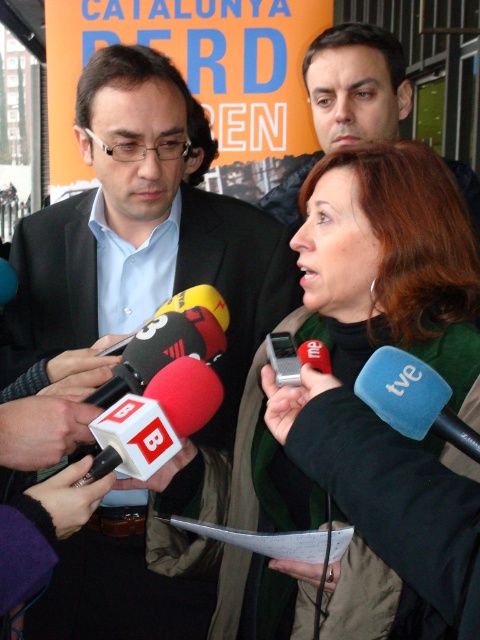
Question: Can you confirm if matte black jacket at upper center is positioned above blue rubber microphone at center?

Choices:
 (A) yes
 (B) no

Answer: (A)

Question: Is green wool scarf at center positioned at the back of matte black jacket at upper center?

Choices:
 (A) no
 (B) yes

Answer: (A)

Question: Which point appears closest to the camera in this image?

Choices:
 (A) click(x=394, y=353)
 (B) click(x=327, y=102)
 (C) click(x=407, y=632)

Answer: (A)

Question: Which object is closer to the camera taking this photo?

Choices:
 (A) green wool scarf at center
 (B) matte black jacket at upper center

Answer: (A)

Question: Is matte black jacket at upper center positioned behind blue rubber microphone at center?

Choices:
 (A) no
 (B) yes

Answer: (B)

Question: Which point is farther to the camera?

Choices:
 (A) green wool scarf at center
 (B) matte black suit at center
 (C) matte black jacket at upper center
 (D) blue rubber microphone at center

Answer: (C)